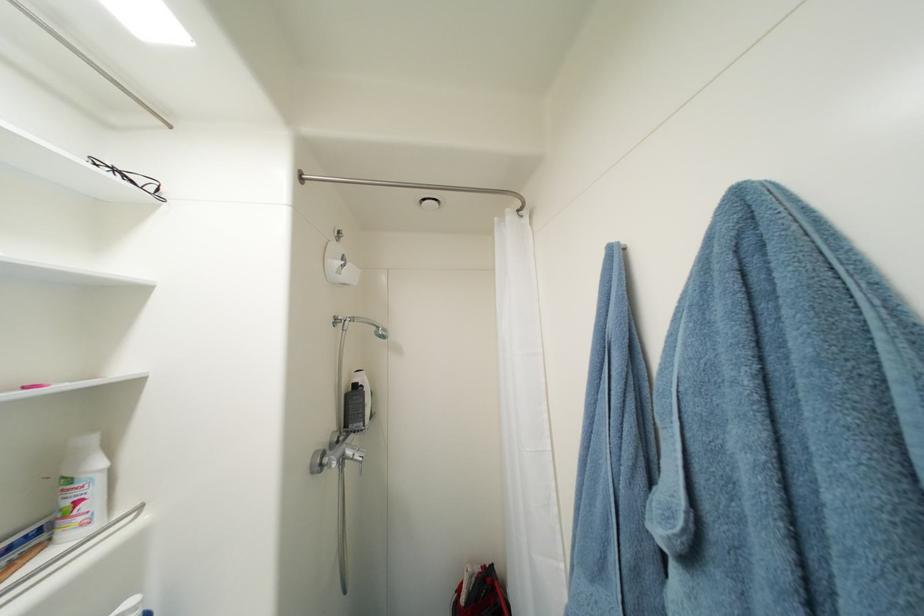
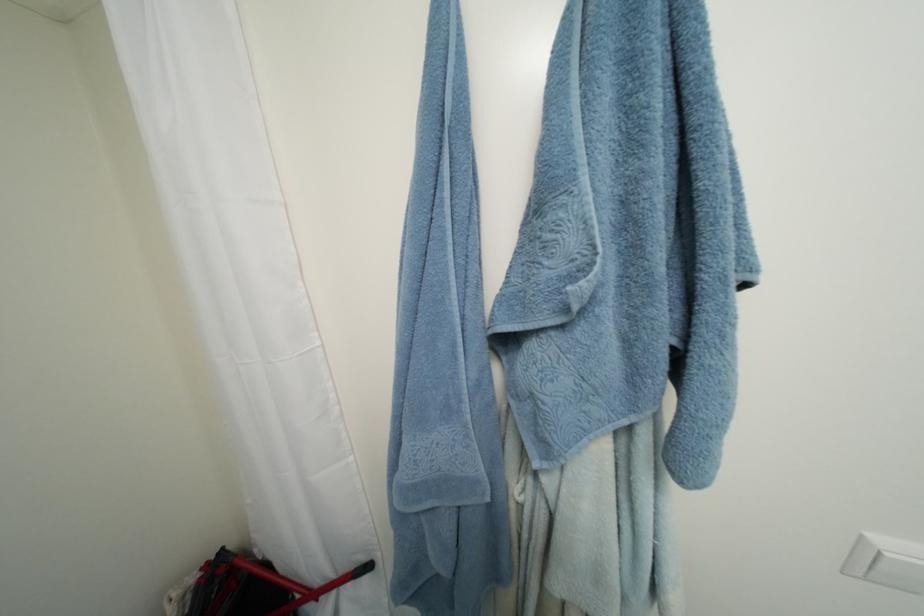
First-person continuous shooting, in which direction is the camera rotating?

The camera rotated toward right-down.